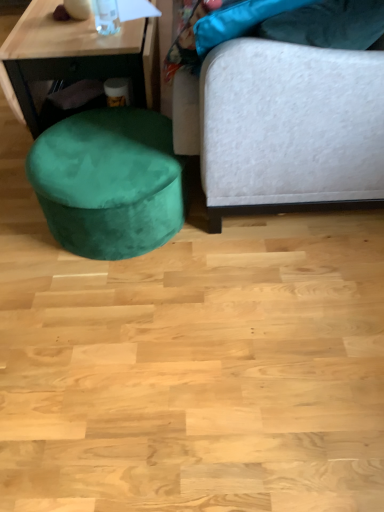
Image resolution: width=384 pixels, height=512 pixels. What are the coordinates of `spots to the right of transparent glass bottle at upper left` in the screenshot? It's located at (135, 28).